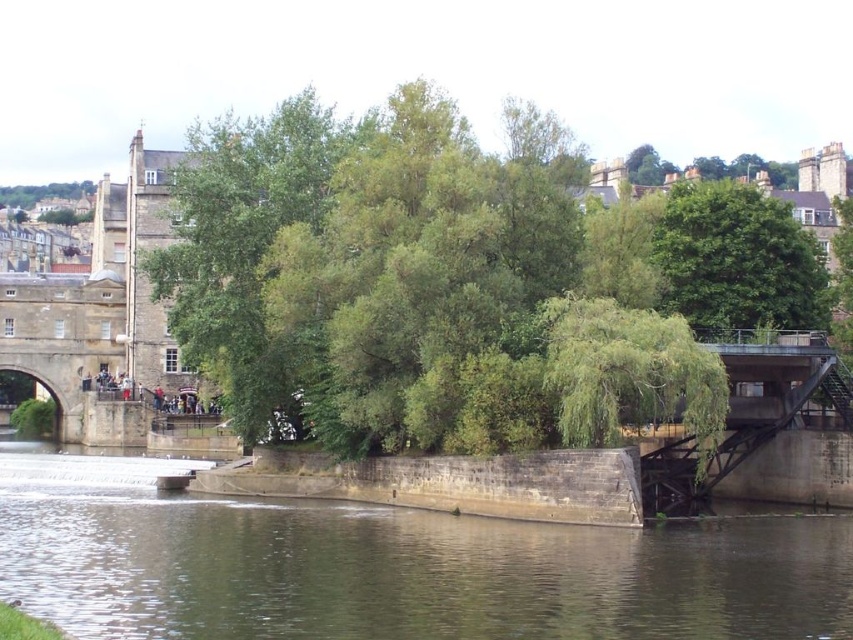
Does point (200, 349) come in front of point (59, 192)?

Yes, point (200, 349) is in front of point (59, 192).

Is green leafy tree at center in front of green leafy tree at upper left?

Yes.

At what (x,y) coordinates should I click in order to perform the action: click on green leafy tree at center. Please return your answer as a coordinate pair (x, y). The width and height of the screenshot is (853, 640). Looking at the image, I should click on (x=462, y=282).

The width and height of the screenshot is (853, 640). Identify the location of green leafy tree at center. (462, 282).

Is brown stone river at center smaller than concrete bridge at right?

No, brown stone river at center is not smaller than concrete bridge at right.

Find the location of a particular element. The height and width of the screenshot is (640, 853). brown stone river at center is located at coordinates (392, 566).

Does point (91, 608) come farther from viewer compared to point (772, 392)?

No.

Where is `brown stone river at center`? The height and width of the screenshot is (640, 853). brown stone river at center is located at coordinates tap(392, 566).

Is green leafy tree at center smaller than concrete bridge at right?

Incorrect, green leafy tree at center is not smaller in size than concrete bridge at right.

Can you confirm if green leafy tree at center is taller than concrete bridge at right?

Correct, green leafy tree at center is much taller as concrete bridge at right.

Is point (366, 125) farther from camera compared to point (828, 362)?

Yes.

Identify the location of green leafy tree at center. This screenshot has width=853, height=640. (462, 282).